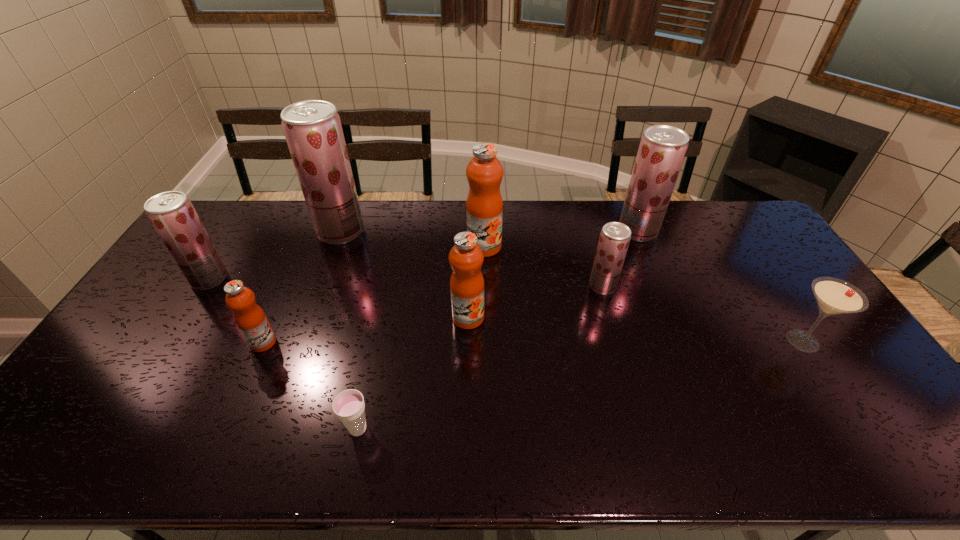
In order to click on the third strawberry fruit juice from left to right in this screenshot , I will do `click(614, 240)`.

Find the location of a particular element. The width and height of the screenshot is (960, 540). the nearest orange fruit juice is located at coordinates (251, 320).

Identify the location of the smallest orange fruit juice. click(251, 320).

You are a GUI agent. You are given a task and a screenshot of the screen. Output one action in this format:
    pyautogui.click(x=<x>, y=<y>)
    Task: Click on the martini
    This screenshot has width=960, height=540.
    Given the screenshot: What is the action you would take?
    pyautogui.click(x=834, y=296)

I want to click on purple cup, so click(348, 405).

Locate an element on the screen. the shortest object is located at coordinates (348, 405).

Locate an element on the screen. This screenshot has height=540, width=960. vacant space located on the right of the biggest strawberry fruit juice is located at coordinates (436, 231).

Find the location of a particular element. blank area located 0.050m on the front of the third smallest strawberry fruit juice is located at coordinates (647, 253).

Find the location of a particular element. free space located on the front label of the farthest orange fruit juice is located at coordinates (485, 319).

You are a GUI agent. You are given a task and a screenshot of the screen. Output one action in this format:
    pyautogui.click(x=<x>, y=<y>)
    Task: Click on the vacant space located on the right of the leftmost fruit juice
    The width and height of the screenshot is (960, 540).
    Given the screenshot: What is the action you would take?
    pyautogui.click(x=324, y=279)